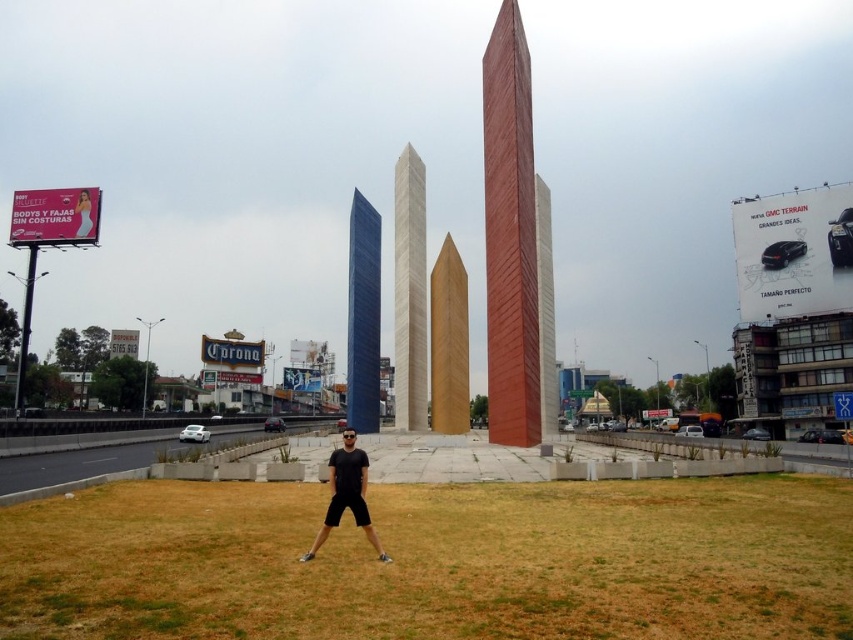
Question: Does white marble tower at center have a lesser width compared to red brick tower at center?

Choices:
 (A) no
 (B) yes

Answer: (B)

Question: Does smooth reddish-brown tower at center have a smaller size compared to smooth white shirt at center?

Choices:
 (A) yes
 (B) no

Answer: (B)

Question: Does white marble tower at center appear on the left side of golden polished obelisk at center?

Choices:
 (A) no
 (B) yes

Answer: (B)

Question: Which is farther from the red brick tower at center?

Choices:
 (A) golden polished obelisk at center
 (B) white marble tower at center
 (C) brown dry grass at center
 (D) blue glass tower at center

Answer: (C)

Question: Which of the following is the closest to the observer?

Choices:
 (A) blue glass tower at center
 (B) black matte shorts at center
 (C) red brick tower at center
 (D) brown dry grass at center

Answer: (D)

Question: Which of the following is the farthest from the observer?

Choices:
 (A) (358, 365)
 (B) (328, 513)
 (C) (460, 372)
 (D) (750, 500)

Answer: (C)